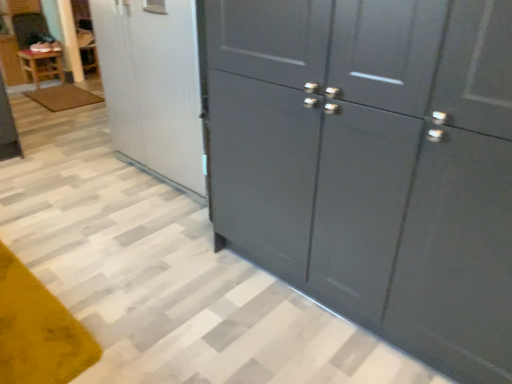
The width and height of the screenshot is (512, 384). What do you see at coordinates (153, 85) in the screenshot?
I see `white glossy refrigerator at upper left` at bounding box center [153, 85].

Measure the distance between point (136,85) and camera.

Point (136,85) and camera are 7.65 feet apart from each other.

What are the coordinates of `wooden table at left` in the screenshot? It's located at (41, 65).

Describe the element at coordinates (373, 163) in the screenshot. I see `glossy dark gray cupboard at right` at that location.

Describe the element at coordinates (63, 97) in the screenshot. I see `brown textured mat at lower left` at that location.

Identify the location of white glossy refrigerator at upper left. Image resolution: width=512 pixels, height=384 pixels. (153, 85).

Which object is thinner, wooden table at left or glossy dark gray cupboard at right?

With smaller width is wooden table at left.

Considering their positions, is wooden table at left located in front of or behind glossy dark gray cupboard at right?

In the image, wooden table at left appears behind glossy dark gray cupboard at right.

This screenshot has height=384, width=512. In the image, there is a glossy dark gray cupboard at right. In order to click on furniture above it (from the image's perspective) in this screenshot , I will do `click(41, 65)`.

Is wooden table at left touching glossy dark gray cupboard at right?

No, wooden table at left is not touching glossy dark gray cupboard at right.

The width and height of the screenshot is (512, 384). What are the coordinates of `screen door below the brown textured mat at lower left (from the image's perspective)` in the screenshot? It's located at (153, 85).

Based on the photo, from a real-world perspective, who is located higher, white glossy refrigerator at upper left or brown textured mat at lower left?

white glossy refrigerator at upper left is physically above.

Is white glossy refrigerator at upper left bigger or smaller than brown textured mat at lower left?

In the image, white glossy refrigerator at upper left appears to be larger than brown textured mat at lower left.

Based on the photo, considering the relative positions of white glossy refrigerator at upper left and brown textured mat at lower left in the image provided, is white glossy refrigerator at upper left in front of brown textured mat at lower left?

Yes, it is.

Which of these two, brown textured mat at lower left or wooden table at left, is wider?

With larger width is brown textured mat at lower left.

How much distance is there between brown textured mat at lower left and wooden table at left?

A distance of 18.09 inches exists between brown textured mat at lower left and wooden table at left.

Looking at the image, does brown textured mat at lower left seem bigger or smaller compared to wooden table at left?

brown textured mat at lower left is smaller than wooden table at left.

Between point (62, 104) and point (31, 69), which one is positioned behind?

The point (31, 69) is farther from the camera.

From a real-world perspective, between brown textured mat at lower left and glossy dark gray cupboard at right, who is vertically lower?

From a 3D spatial view, brown textured mat at lower left is below.

From the image's perspective, is brown textured mat at lower left located above or below glossy dark gray cupboard at right?

Clearly, from the image's perspective, brown textured mat at lower left is above glossy dark gray cupboard at right.

Can you confirm if brown textured mat at lower left is positioned to the right of glossy dark gray cupboard at right?

In fact, brown textured mat at lower left is to the left of glossy dark gray cupboard at right.

Considering the points (121, 117) and (54, 58), which point is behind, point (121, 117) or point (54, 58)?

The point (54, 58) is farther from the camera.

Is white glossy refrigerator at upper left facing away from wooden table at left?

No, white glossy refrigerator at upper left is not facing the opposite direction of wooden table at left.

From a real-world perspective, is white glossy refrigerator at upper left physically located above or below wooden table at left?

In terms of real-world spatial position, white glossy refrigerator at upper left is above wooden table at left.

Between white glossy refrigerator at upper left and wooden table at left, which one appears on the right side from the viewer's perspective?

white glossy refrigerator at upper left is more to the right.

Which object is further away from the camera, glossy dark gray cupboard at right or brown textured mat at lower left?

brown textured mat at lower left is behind.

Considering the positions of objects glossy dark gray cupboard at right and brown textured mat at lower left in the image provided, who is more to the left, glossy dark gray cupboard at right or brown textured mat at lower left?

From the viewer's perspective, brown textured mat at lower left appears more on the left side.

Who is smaller, glossy dark gray cupboard at right or brown textured mat at lower left?

Smaller between the two is brown textured mat at lower left.

From the image's perspective, which object appears higher, glossy dark gray cupboard at right or brown textured mat at lower left?

brown textured mat at lower left is shown above in the image.

In the scene shown: Is white glossy refrigerator at upper left not within glossy dark gray cupboard at right?

Yes.

From their relative heights in the image, would you say white glossy refrigerator at upper left is taller or shorter than glossy dark gray cupboard at right?

Considering their sizes, white glossy refrigerator at upper left has less height than glossy dark gray cupboard at right.

From the image's perspective, does white glossy refrigerator at upper left appear lower than glossy dark gray cupboard at right?

No, from the image's perspective, white glossy refrigerator at upper left is not below glossy dark gray cupboard at right.

I want to click on furniture lying above the glossy dark gray cupboard at right (from the image's perspective), so click(41, 65).

Where is `screen door in front of the brown textured mat at lower left`? screen door in front of the brown textured mat at lower left is located at coordinates (153, 85).

Which object lies further to the anchor point white glossy refrigerator at upper left, wooden table at left or brown textured mat at lower left?

wooden table at left is positioned further to the anchor white glossy refrigerator at upper left.

Considering their positions, is white glossy refrigerator at upper left positioned closer to wooden table at left than glossy dark gray cupboard at right?

white glossy refrigerator at upper left lies closer to wooden table at left than the other object.

Looking at the image, which one is located further to glossy dark gray cupboard at right, white glossy refrigerator at upper left or brown textured mat at lower left?

brown textured mat at lower left is positioned further to the anchor glossy dark gray cupboard at right.

Considering their positions, is glossy dark gray cupboard at right positioned further to wooden table at left than brown textured mat at lower left?

Among the two, glossy dark gray cupboard at right is located further to wooden table at left.

From the image, which object appears to be nearer to glossy dark gray cupboard at right, brown textured mat at lower left or wooden table at left?

brown textured mat at lower left.

Looking at the image, which one is located closer to wooden table at left, white glossy refrigerator at upper left or brown textured mat at lower left?

The object closer to wooden table at left is brown textured mat at lower left.

Looking at the image, which one is located further to glossy dark gray cupboard at right, wooden table at left or white glossy refrigerator at upper left?

wooden table at left is further to glossy dark gray cupboard at right.

When comparing their distances from brown textured mat at lower left, does wooden table at left or white glossy refrigerator at upper left seem closer?

wooden table at left is positioned closer to the anchor brown textured mat at lower left.

Identify the location of mat positioned between glossy dark gray cupboard at right and wooden table at left from near to far. (63, 97).

Where is `screen door positioned between glossy dark gray cupboard at right and wooden table at left from near to far`? The height and width of the screenshot is (384, 512). screen door positioned between glossy dark gray cupboard at right and wooden table at left from near to far is located at coordinates (153, 85).

Identify the location of mat between white glossy refrigerator at upper left and wooden table at left from front to back. Image resolution: width=512 pixels, height=384 pixels. coord(63,97).

The image size is (512, 384). Identify the location of screen door between glossy dark gray cupboard at right and brown textured mat at lower left along the z-axis. pyautogui.click(x=153, y=85).